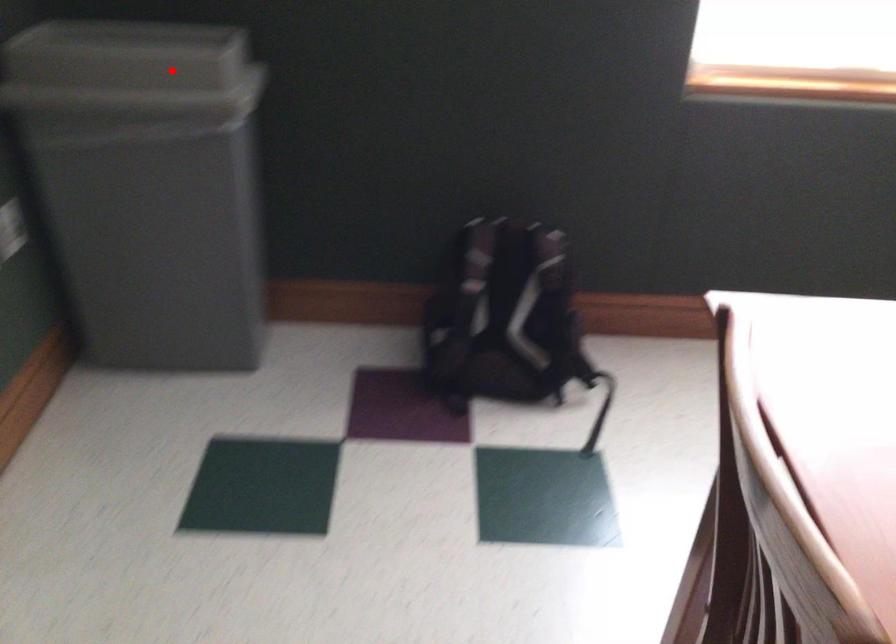
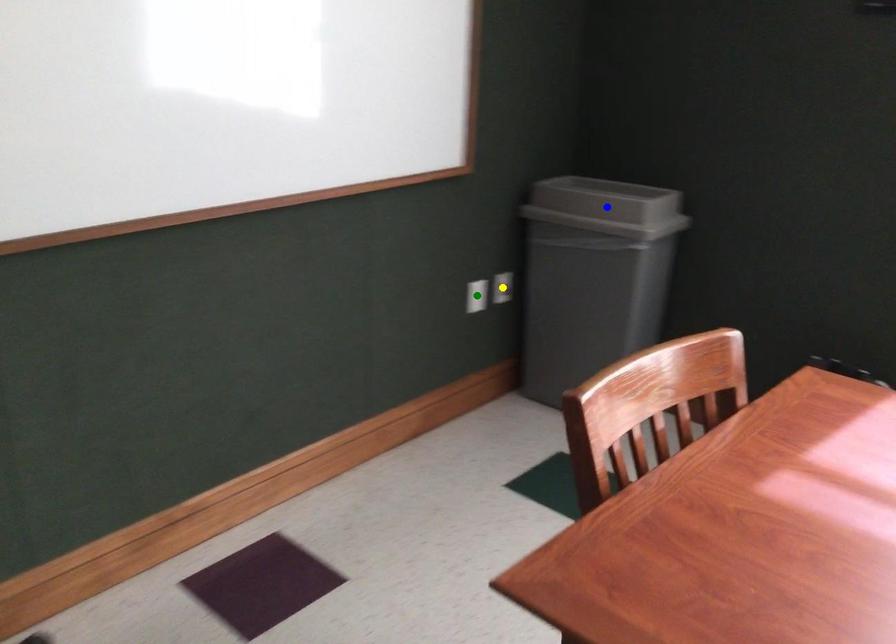
Question: I am providing you with two images of the same scene from different viewpoints. A red point is marked on the first image. You are given multiple points on the second image. Which point in image 2 is actually the same real-world point as the red point in image 1?

Choices:
 (A) yellow point
 (B) green point
 (C) blue point

Answer: (C)